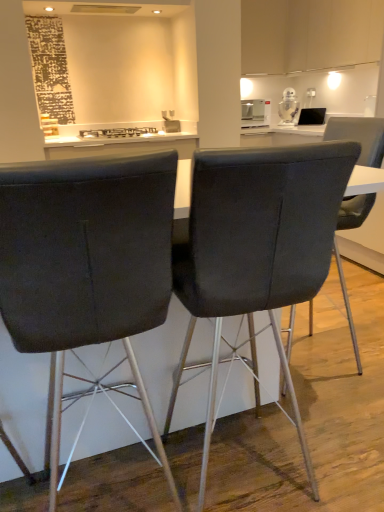
Question: Considering the positions of satin silver toaster at upper center, acting as the second appliance starting from the right, and white glossy robot at upper right, the 1th appliance when ordered from right to left, in the image, is satin silver toaster at upper center, acting as the second appliance starting from the right, wider or thinner than white glossy robot at upper right, the 1th appliance when ordered from right to left,?

Choices:
 (A) wide
 (B) thin

Answer: (A)

Question: From a real-world perspective, is satin silver toaster at upper center, marked as the 1th appliance in a left-to-right arrangement, positioned above or below white glossy robot at upper right, arranged as the 2th appliance when viewed from the left?

Choices:
 (A) below
 (B) above

Answer: (A)

Question: Considering the real-world distances, which object is closest to the satin silver toaster at upper center, marked as the 1th appliance in a left-to-right arrangement?

Choices:
 (A) matte black chair at center, the 2th chair in the left-to-right sequence
 (B) black glass stove at center
 (C) white glossy robot at upper right, arranged as the 2th appliance when viewed from the left
 (D) velvet dark gray chair at center, placed as the third chair when sorted from left to right
 (E) matte black chair at center, arranged as the 3th chair when viewed from the right

Answer: (C)

Question: Which is farther from the matte black chair at center, which is the second chair in right-to-left order?

Choices:
 (A) matte black chair at center, positioned as the 1th chair in left-to-right order
 (B) satin silver toaster at upper center, marked as the 1th appliance in a left-to-right arrangement
 (C) white glossy robot at upper right, the 1th appliance when ordered from right to left
 (D) velvet dark gray chair at center, placed as the third chair when sorted from left to right
 (E) black glass stove at center

Answer: (C)